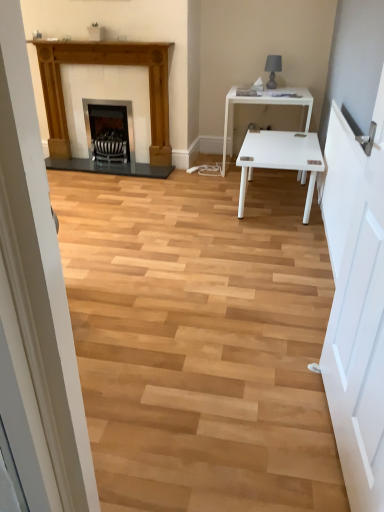
Question: Which direction should I rotate to face matte black fireplace at center, which appears as the first fireplace when viewed from the right, — up or down?

Choices:
 (A) up
 (B) down

Answer: (A)

Question: From the image's perspective, is white glossy table at center over matte black lamp at upper right?

Choices:
 (A) no
 (B) yes

Answer: (A)

Question: From a real-world perspective, is white glossy table at center on top of matte black lamp at upper right?

Choices:
 (A) yes
 (B) no

Answer: (B)

Question: Is white glossy table at center positioned with its back to matte black lamp at upper right?

Choices:
 (A) no
 (B) yes

Answer: (A)

Question: Does white glossy table at center appear on the left side of matte black lamp at upper right?

Choices:
 (A) no
 (B) yes

Answer: (B)

Question: Considering the relative sizes of white glossy table at center and matte black lamp at upper right in the image provided, is white glossy table at center thinner than matte black lamp at upper right?

Choices:
 (A) no
 (B) yes

Answer: (A)

Question: Is the depth of white glossy table at center less than that of matte black lamp at upper right?

Choices:
 (A) yes
 (B) no

Answer: (A)

Question: From a real-world perspective, does matte black lamp at upper right stand above white wooden door at right?

Choices:
 (A) no
 (B) yes

Answer: (B)

Question: Does matte black lamp at upper right have a larger size compared to white wooden door at right?

Choices:
 (A) no
 (B) yes

Answer: (A)

Question: Considering the relative positions of matte black lamp at upper right and white wooden door at right in the image provided, is matte black lamp at upper right to the left of white wooden door at right from the viewer's perspective?

Choices:
 (A) no
 (B) yes

Answer: (A)

Question: Is matte black lamp at upper right positioned far away from white wooden door at right?

Choices:
 (A) no
 (B) yes

Answer: (B)

Question: Is matte black lamp at upper right turned away from white wooden door at right?

Choices:
 (A) yes
 (B) no

Answer: (B)

Question: Are matte black lamp at upper right and white wooden door at right making contact?

Choices:
 (A) no
 (B) yes

Answer: (A)

Question: Is matte black fireplace at center, which is the second fireplace from left to right, looking in the opposite direction of matte black lamp at upper right?

Choices:
 (A) yes
 (B) no

Answer: (B)